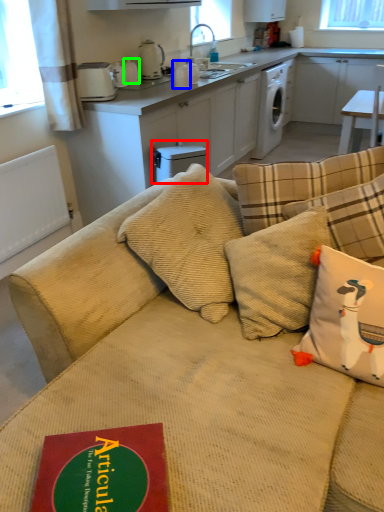
Question: Which object is positioned closest to dish washer (highlighted by a red box)? Select from appliance (highlighted by a blue box) and appliance (highlighted by a green box).

Choices:
 (A) appliance
 (B) appliance

Answer: (A)